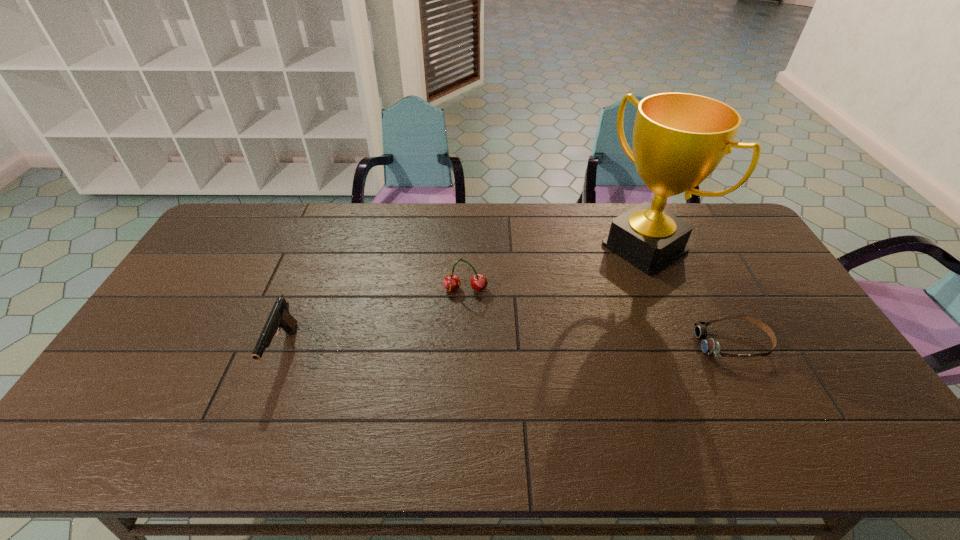
Find the location of `pistol`. pistol is located at coordinates pyautogui.click(x=279, y=317).

Locate an element on the screen. The width and height of the screenshot is (960, 540). the shortest object is located at coordinates (710, 347).

You are a GUI agent. You are given a task and a screenshot of the screen. Output one action in this format:
    pyautogui.click(x=<x>, y=<y>)
    Task: Click on the cherry
    The width and height of the screenshot is (960, 540).
    Given the screenshot: What is the action you would take?
    pyautogui.click(x=452, y=282)

Find the location of a particular element. The image size is (960, 540). the tallest object is located at coordinates (679, 139).

The image size is (960, 540). What are the coordinates of `vacant space located at the muzzle of the pistol` in the screenshot? It's located at (263, 405).

At what (x,y) coordinates should I click in order to perform the action: click on vacant space situated 0.360m on the front-facing side of the shortest object. Please return your answer as a coordinate pair (x, y). Looking at the image, I should click on (569, 343).

The height and width of the screenshot is (540, 960). Find the location of `vacant region located on the front-facing side of the shortest object`. vacant region located on the front-facing side of the shortest object is located at coordinates (662, 343).

Locate an element on the screen. Image resolution: width=960 pixels, height=540 pixels. free location located on the front-facing side of the shortest object is located at coordinates [588, 343].

What are the coordinates of `free space located with stems pointing upwards on the third object from right to left` in the screenshot? It's located at (465, 310).

Identify the location of blank space located with stems pointing upwards on the third object from right to left. The width and height of the screenshot is (960, 540). pos(460,386).